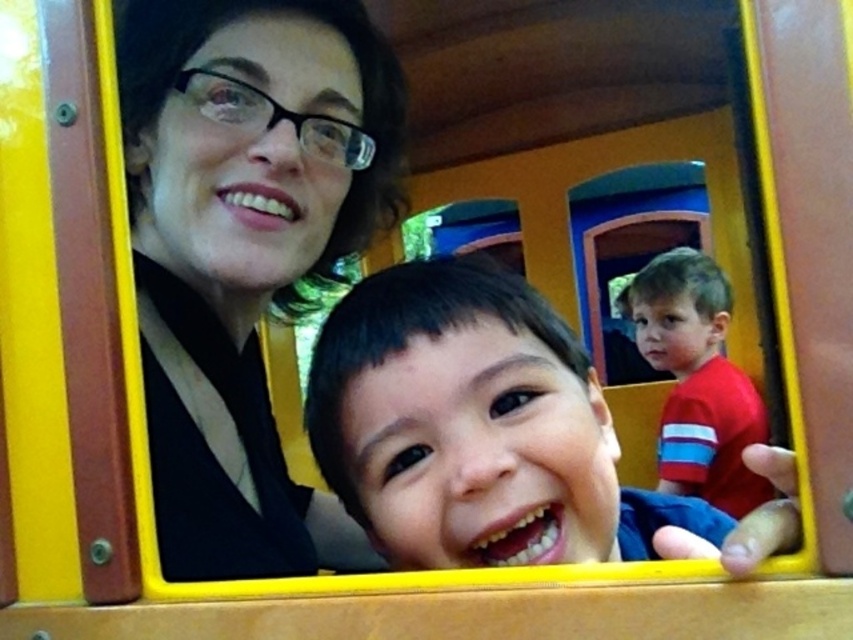
You are a photographer standing outside the train car and want to capture both the matte black hair at upper left and the red smooth shirt at right in a single photo. Which object should you focus on first to ensure both are in frame?

You should focus on the matte black hair at upper left first because it is positioned over the red smooth shirt at right, meaning it is closer to you. By focusing on the closer object, both will be in the frame.

You are standing at the entrance of the train car and want to locate the matte black hair at upper left. According to the coordinates provided, where should you look?

You should look at point (242, 256) to find the matte black hair at upper left.

You are standing in the train car and want to reach both the point at coordinates point (392, 156) and the point at coordinates point (790, 468). Which point should you move towards first to reach the closer one?

You should move towards point (392, 156) first because it is closer to you than point (790, 468).